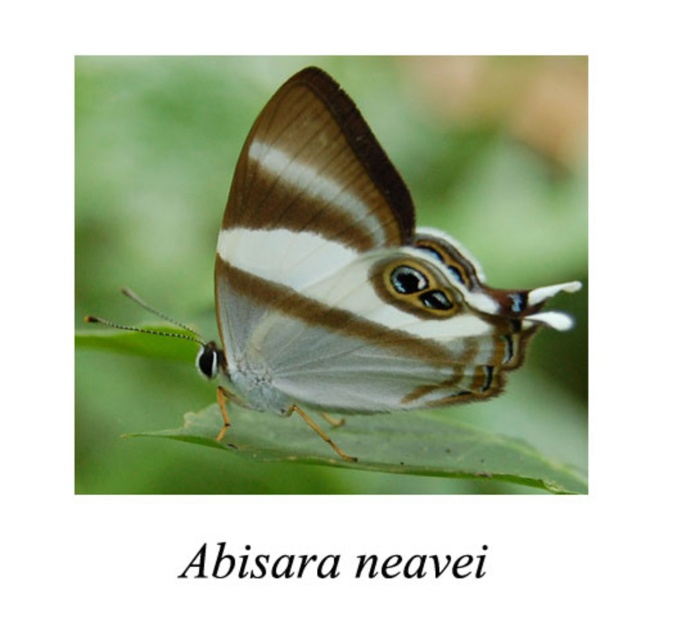
Which is behind, point (407, 381) or point (397, 458)?

Positioned behind is point (397, 458).

Can you confirm if matte brown butterfly at center is positioned above green matte leaf at center?

Yes, matte brown butterfly at center is above green matte leaf at center.

Which is behind, point (305, 205) or point (466, 436)?

The point (466, 436) is behind.

Locate an element on the screen. matte brown butterfly at center is located at coordinates (344, 280).